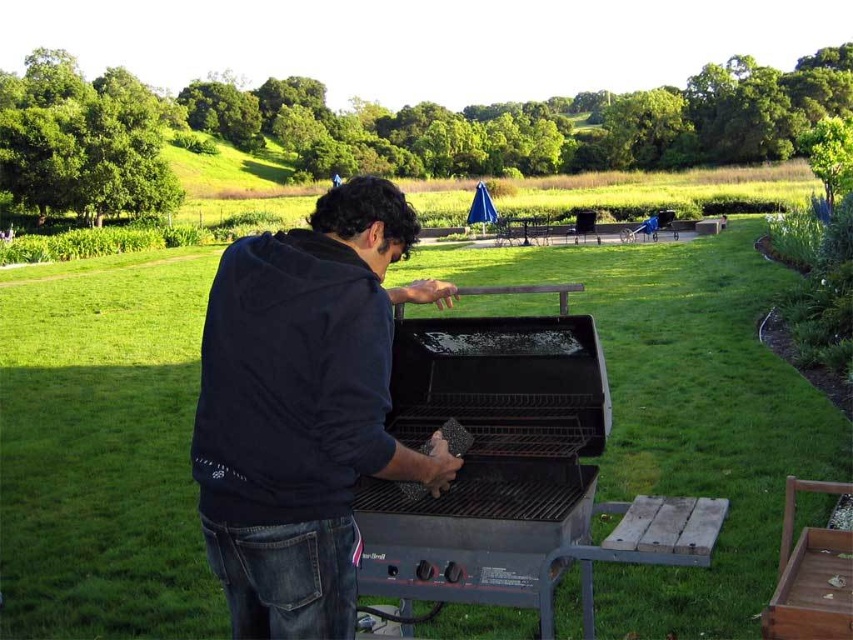
Question: Does dark blue hoodie at center have a greater width compared to black matte barbecue grill at center?

Choices:
 (A) yes
 (B) no

Answer: (A)

Question: Is the position of dark blue hoodie at center less distant than that of black matte barbecue grill at center?

Choices:
 (A) yes
 (B) no

Answer: (A)

Question: Which object appears farthest from the camera in this image?

Choices:
 (A) dark blue hoodie at center
 (B) black matte barbecue grill at center

Answer: (B)

Question: Does dark blue hoodie at center have a larger size compared to black matte barbecue grill at center?

Choices:
 (A) no
 (B) yes

Answer: (B)